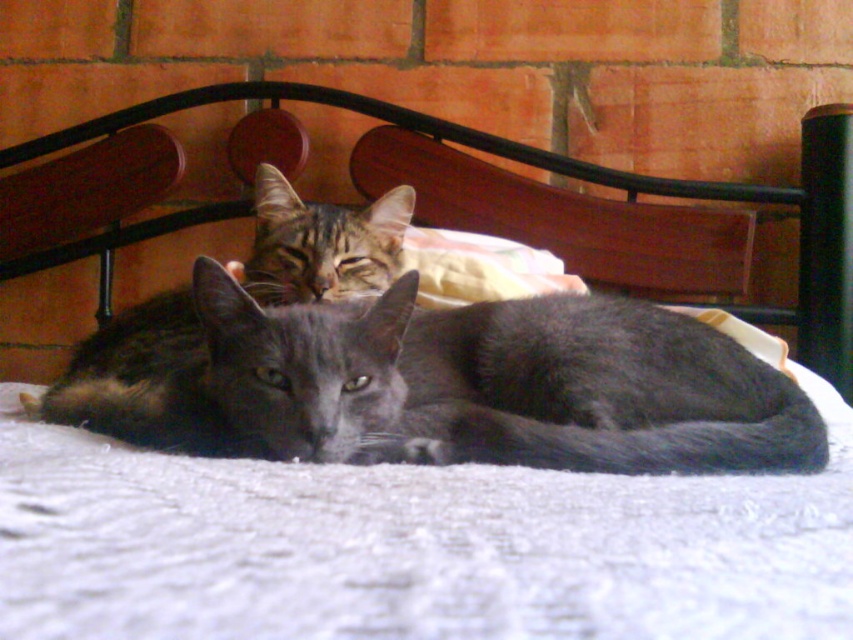
You are a photographer taking a picture of two cats on a bed. You notice the shiny gray cat at center and the gray fur cat at center. Which cat is closer to the camera?

The shiny gray cat at center is shorter than the gray fur cat at center, so the gray fur cat at center is closer to the camera.

You are looking at the image of two cats on a bed. There are two points marked in the image. The first point is at coordinate point (517, 444) and the second point is at coordinate point (105, 422). Which of these two points is closer to you?

Point (517, 444) is closer to the viewer than point (105, 422).

You are a photographer trying to capture a closeup of the cats. Since you want the subject to be in focus, which cat should you focus on, the shiny gray cat at center or the gray fur cat at center?

You should focus on the shiny gray cat at center because it is closer to the viewer than the gray fur cat at center.